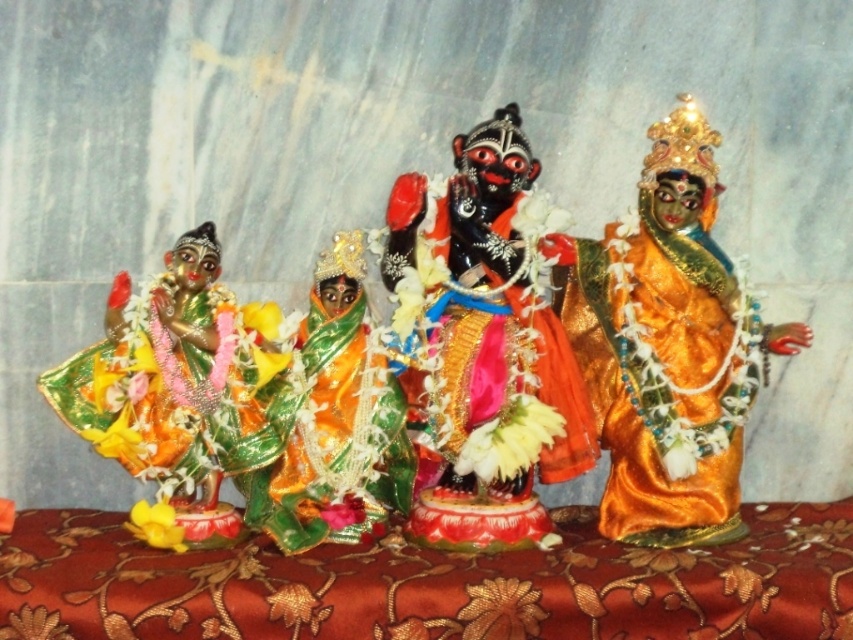
You are an interior designer planning to place a new decorative item on a shelf where the black glossy statue at center is currently located. The shelf has a coordinate system where the bottom left corner is the origin point. The statue is at position point 0.542, 0.570. If you want to place the new item 0.1 units to the right and 0.05 units above the statue, what would be the new coordinates?

The new coordinates would be calculated by adding 0.1 to the x coordinate and 0.05 to the y coordinate of the black glossy statue at center. The original position is (485, 346). Adding 0.1 to the x gives 0.642, and adding 0.05 to the y gives 0.620. Therefore, the new coordinates are (527, 410).